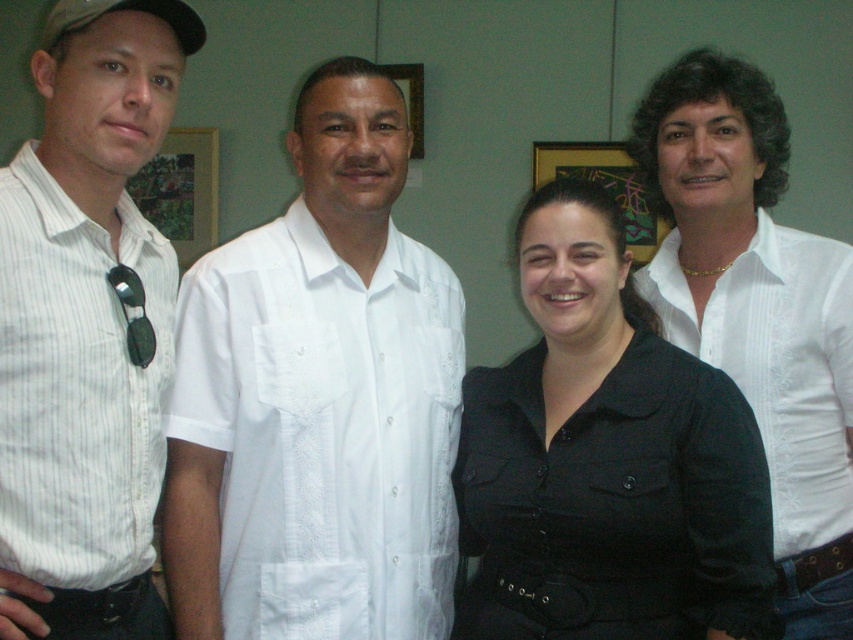
Which is below, white embroidered shirt at center or brushed metal picture frame at left?

white embroidered shirt at center

Between point (287, 512) and point (201, 172), which one is positioned behind?

Positioned behind is point (201, 172).

Locate an element on the screen. The image size is (853, 640). white embroidered shirt at center is located at coordinates pos(323,432).

Can you confirm if white textured shirt at upper right is smaller than metallic gold picture frame at upper center?

Actually, white textured shirt at upper right might be larger than metallic gold picture frame at upper center.

Measure the distance between point (851, 364) and camera.

A distance of 1.54 meters exists between point (851, 364) and camera.

The width and height of the screenshot is (853, 640). What do you see at coordinates (778, 364) in the screenshot?
I see `white textured shirt at upper right` at bounding box center [778, 364].

Identify the location of white textured shirt at upper right. (778, 364).

Does white embroidered shirt at center have a lesser height compared to white textured shirt at upper right?

No.

Can you confirm if white embroidered shirt at center is positioned above white textured shirt at upper right?

Actually, white embroidered shirt at center is below white textured shirt at upper right.

Image resolution: width=853 pixels, height=640 pixels. What are the coordinates of `white embroidered shirt at center` in the screenshot? It's located at (323, 432).